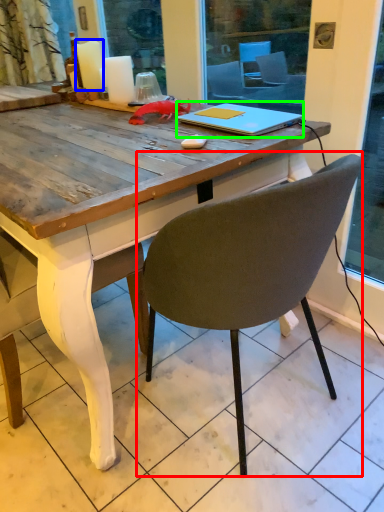
Question: Which object is the closest to the chair (highlighted by a red box)? Choose among these: candle (highlighted by a blue box) or notebook (highlighted by a green box).

Choices:
 (A) candle
 (B) notebook

Answer: (B)